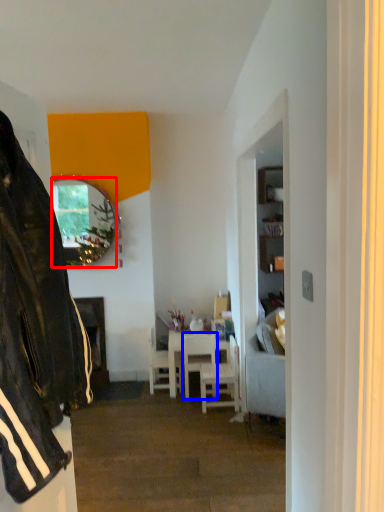
Question: Which point is further to the camera, mirror (highlighted by a red box) or chair (highlighted by a blue box)?

Choices:
 (A) mirror
 (B) chair

Answer: (A)